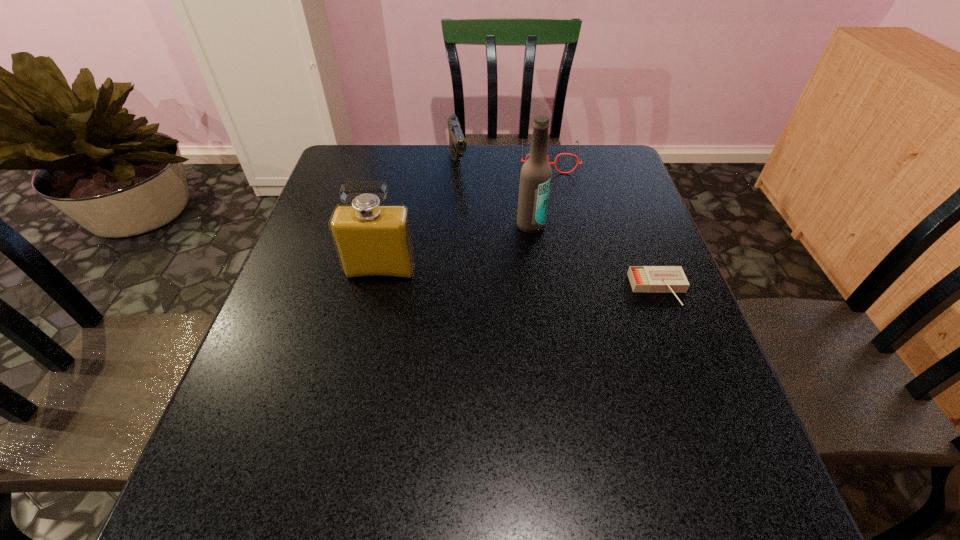
Identify the location of vacant space located on the striking surface of the shortest object. (676, 335).

In order to click on free location located 0.240m at the barrel of the third tallest object in this screenshot , I will do `click(474, 232)`.

Identify the location of free spot located 0.190m at the barrel of the third tallest object. (470, 220).

You are a GUI agent. You are given a task and a screenshot of the screen. Output one action in this format:
    pyautogui.click(x=<x>, y=<y>)
    Task: Click on the free space located at the barrel of the third tallest object
    
    Given the screenshot: What is the action you would take?
    pyautogui.click(x=468, y=213)

Identify the location of free space located on the label of the beer bottle. The width and height of the screenshot is (960, 540). (547, 266).

This screenshot has width=960, height=540. I want to click on free space located on the label of the beer bottle, so click(x=543, y=258).

Image resolution: width=960 pixels, height=540 pixels. Find the location of `vacant position located 0.300m on the label of the beer bottle`. vacant position located 0.300m on the label of the beer bottle is located at coordinates (569, 325).

At what (x,y) coordinates should I click in order to perform the action: click on vacant area located 0.160m on the front-facing side of the fourth tallest object. Please return your answer as a coordinate pair (x, y). The height and width of the screenshot is (540, 960). Looking at the image, I should click on (552, 206).

Identify the location of vacant space located on the front-facing side of the fourth tallest object. (551, 195).

In order to click on vacant space located 0.350m on the front-facing side of the fourth tallest object in this screenshot , I will do `click(555, 253)`.